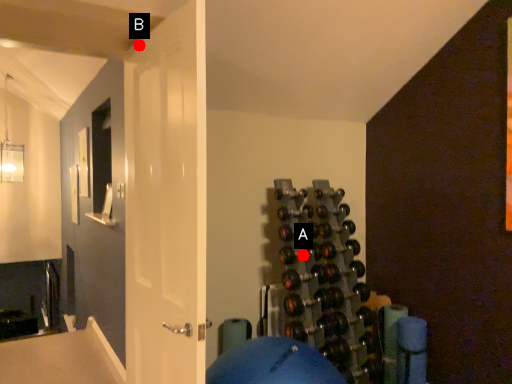
Question: Two points are circled on the image, labeled by A and B beside each circle. Which point appears farthest from the camera in this image?

Choices:
 (A) A is further
 (B) B is further

Answer: (A)